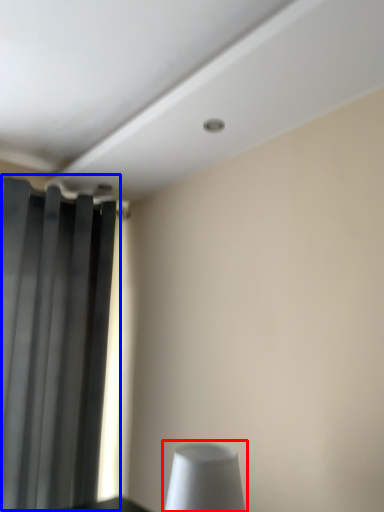
Question: Which of the following is the farthest to the observer, table lamp (highlighted by a red box) or curtain (highlighted by a blue box)?

Choices:
 (A) table lamp
 (B) curtain

Answer: (B)